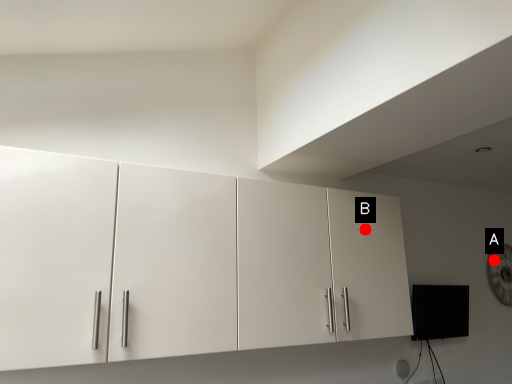
Question: Two points are circled on the image, labeled by A and B beside each circle. Which of the following is the closest to the observer?

Choices:
 (A) A is closer
 (B) B is closer

Answer: (B)